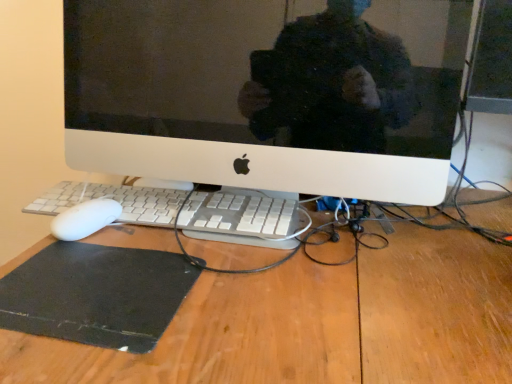
Identify the location of vacant space underneath black rubber mousepad at lower left (from a real-world perspective). This screenshot has width=512, height=384. (97, 284).